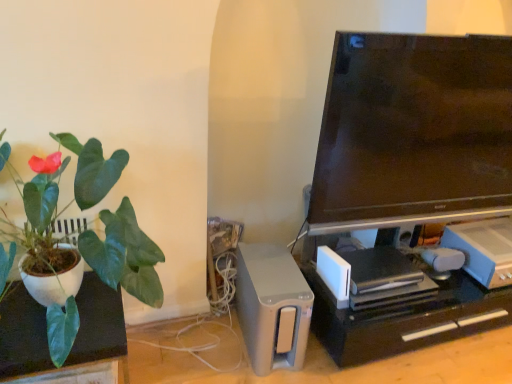
Find the location of a particular element. free location above satin silver speaker at lower center, the first appliance viewed from the left (from a real-world perspective) is located at coordinates (277, 280).